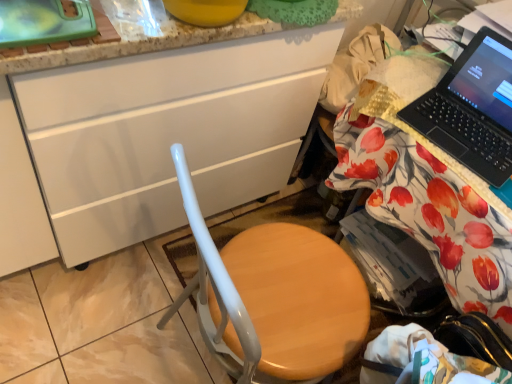
The width and height of the screenshot is (512, 384). In order to click on vacant space in black plastic laptop at upper right (from a real-world perspective) in this screenshot , I will do click(x=474, y=135).